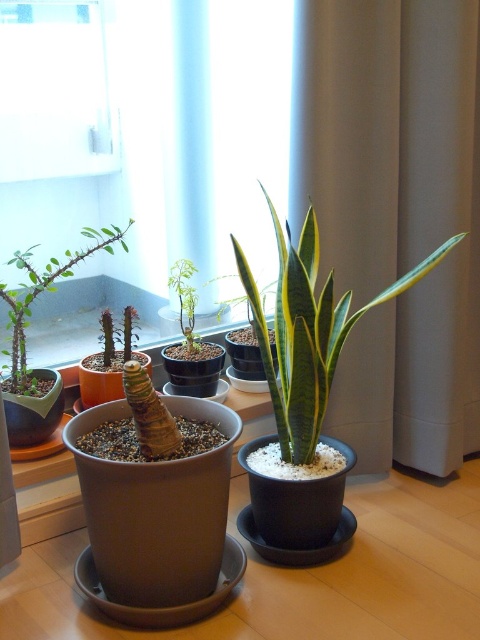
Is green matte leafy plant at center to the right of green matte succulent at left from the viewer's perspective?

Indeed, green matte leafy plant at center is positioned on the right side of green matte succulent at left.

What do you see at coordinates (308, 330) in the screenshot? I see `green matte leafy plant at center` at bounding box center [308, 330].

The height and width of the screenshot is (640, 480). What are the coordinates of `green matte leafy plant at center` in the screenshot? It's located at (308, 330).

Between green matte succulent at left and green matte plant at center, which one is positioned lower?

Positioned lower is green matte plant at center.

Between green matte succulent at left and green matte plant at center, which one appears on the left side from the viewer's perspective?

green matte succulent at left

At what (x,y) coordinates should I click in order to perform the action: click on green matte succulent at left. Please return your answer as a coordinate pair (x, y). The width and height of the screenshot is (480, 640). Looking at the image, I should click on (45, 291).

Can you confirm if green matte leafy plant at center is positioned below green matte plant at center?

Yes, green matte leafy plant at center is below green matte plant at center.

Can you confirm if green matte leafy plant at center is thinner than green matte plant at center?

Incorrect, green matte leafy plant at center's width is not less than green matte plant at center's.

Where is `green matte leafy plant at center`? green matte leafy plant at center is located at coordinates (308, 330).